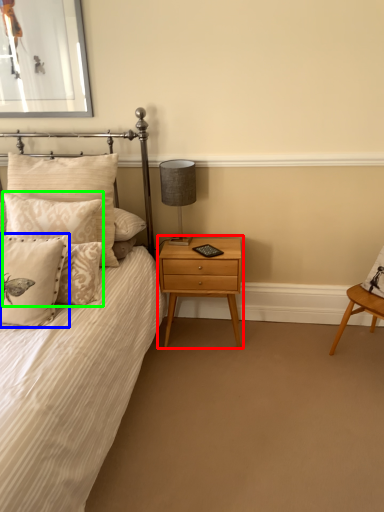
Question: Considering the real-world distances, which object is farthest from nightstand (highlighted by a red box)? pillow (highlighted by a blue box) or pillow (highlighted by a green box)?

Choices:
 (A) pillow
 (B) pillow

Answer: (A)